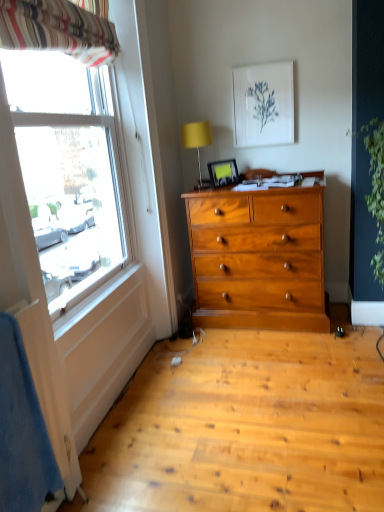
What do you see at coordinates (263, 104) in the screenshot? This screenshot has height=512, width=384. I see `white paper at upper center, positioned as the first picture frame in top-to-bottom order` at bounding box center [263, 104].

Where is `matte plastic picture frame at upper center, which appears as the 1th picture frame when ordered from the bottom`? The width and height of the screenshot is (384, 512). matte plastic picture frame at upper center, which appears as the 1th picture frame when ordered from the bottom is located at coordinates (223, 173).

Identify the location of curtain in front of the yellow fabric lampshade at upper center. (58, 30).

From the picture: Can we say yellow fabric lampshade at upper center lies outside striped fabric curtain at upper left?

Absolutely, yellow fabric lampshade at upper center is external to striped fabric curtain at upper left.

Which object is positioned more to the left, yellow fabric lampshade at upper center or striped fabric curtain at upper left?

Positioned to the left is striped fabric curtain at upper left.

Is yellow fabric lampshade at upper center turned away from striped fabric curtain at upper left?

yellow fabric lampshade at upper center is not turned away from striped fabric curtain at upper left.

Is striped fabric curtain at upper left positioned in front of green leafy plant at right?

Yes, striped fabric curtain at upper left is closer to the camera.

Does point (66, 39) appear closer or farther from the camera than point (381, 140)?

Point (66, 39) is positioned closer to the camera compared to point (381, 140).

How much distance is there between striped fabric curtain at upper left and green leafy plant at right?

striped fabric curtain at upper left is 1.72 meters away from green leafy plant at right.

The width and height of the screenshot is (384, 512). I want to click on curtain above the green leafy plant at right (from the image's perspective), so click(58, 30).

Which object is positioned more to the right, white paper at upper center, placed as the 2th picture frame when sorted from left to right, or matte plastic picture frame at upper center, marked as the first picture frame in a left-to-right arrangement?

Positioned to the right is white paper at upper center, placed as the 2th picture frame when sorted from left to right.

Is white paper at upper center, acting as the second picture frame starting from the bottom, aimed at matte plastic picture frame at upper center, the 2th picture frame when ordered from right to left?

No.

Based on the photo, do you think white paper at upper center, acting as the second picture frame starting from the bottom, is within matte plastic picture frame at upper center, which appears as the 1th picture frame when ordered from the bottom, or outside of it?

white paper at upper center, acting as the second picture frame starting from the bottom, is located beyond the bounds of matte plastic picture frame at upper center, which appears as the 1th picture frame when ordered from the bottom.

In the image, there is a white paper at upper center, positioned as the first picture frame in top-to-bottom order. At what (x,y) coordinates should I click in order to perform the action: click on picture frame below it (from a real-world perspective). Please return your answer as a coordinate pair (x, y). This screenshot has width=384, height=512. Looking at the image, I should click on (223, 173).

From the image's perspective, is striped fabric curtain at upper left above or below white paper at upper center, the 1th picture frame positioned from the right?

From the image's perspective, striped fabric curtain at upper left appears above white paper at upper center, the 1th picture frame positioned from the right.

Considering the relative sizes of striped fabric curtain at upper left and white paper at upper center, placed as the 2th picture frame when sorted from left to right, in the image provided, is striped fabric curtain at upper left shorter than white paper at upper center, placed as the 2th picture frame when sorted from left to right,?

Correct, striped fabric curtain at upper left is not as tall as white paper at upper center, placed as the 2th picture frame when sorted from left to right.

Considering the relative sizes of striped fabric curtain at upper left and white paper at upper center, acting as the second picture frame starting from the bottom, in the image provided, is striped fabric curtain at upper left wider than white paper at upper center, acting as the second picture frame starting from the bottom,?

Yes, striped fabric curtain at upper left is wider than white paper at upper center, acting as the second picture frame starting from the bottom.

How much distance is there between green leafy plant at right and matte plastic picture frame at upper center, marked as the first picture frame in a left-to-right arrangement?

green leafy plant at right and matte plastic picture frame at upper center, marked as the first picture frame in a left-to-right arrangement, are 38.43 inches apart from each other.

Does green leafy plant at right have a larger size compared to matte plastic picture frame at upper center, marked as the first picture frame in a left-to-right arrangement?

Indeed, green leafy plant at right has a larger size compared to matte plastic picture frame at upper center, marked as the first picture frame in a left-to-right arrangement.

Is green leafy plant at right to the left or to the right of matte plastic picture frame at upper center, which ranks as the second picture frame in top-to-bottom order, in the image?

From the image, it's evident that green leafy plant at right is to the right of matte plastic picture frame at upper center, which ranks as the second picture frame in top-to-bottom order.

Can you confirm if green leafy plant at right is shorter than matte plastic picture frame at upper center, which ranks as the second picture frame in top-to-bottom order?

Incorrect, the height of green leafy plant at right does not fall short of that of matte plastic picture frame at upper center, which ranks as the second picture frame in top-to-bottom order.

From the image's perspective, which is below, striped fabric curtain at upper left or yellow fabric lampshade at upper center?

yellow fabric lampshade at upper center appears lower in the image.

Do you think striped fabric curtain at upper left is within yellow fabric lampshade at upper center, or outside of it?

striped fabric curtain at upper left is not enclosed by yellow fabric lampshade at upper center.

Considering the positions of objects striped fabric curtain at upper left and yellow fabric lampshade at upper center in the image provided, who is more to the left, striped fabric curtain at upper left or yellow fabric lampshade at upper center?

Positioned to the left is striped fabric curtain at upper left.

Which object is closer to the camera, striped fabric curtain at upper left or yellow fabric lampshade at upper center?

striped fabric curtain at upper left is more forward.

Looking at this image, can you confirm if white paper at upper center, the 1th picture frame positioned from the right, is positioned to the left of green leafy plant at right?

Yes.

Based on their sizes in the image, would you say white paper at upper center, positioned as the first picture frame in top-to-bottom order, is bigger or smaller than green leafy plant at right?

Clearly, white paper at upper center, positioned as the first picture frame in top-to-bottom order, is smaller in size than green leafy plant at right.

From a real-world perspective, does white paper at upper center, the 1th picture frame positioned from the right, sit lower than green leafy plant at right?

Incorrect, from a real-world perspective, white paper at upper center, the 1th picture frame positioned from the right, is higher than green leafy plant at right.

Identify the location of lamp on the right of the striped fabric curtain at upper left. (196, 138).

In the image, there is a striped fabric curtain at upper left. Identify the location of plant below it (from the image's perspective). Image resolution: width=384 pixels, height=512 pixels. (375, 188).

Considering their positions, is yellow fabric lampshade at upper center positioned closer to white paper at upper center, the 1th picture frame positioned from the right, than matte plastic picture frame at upper center, which ranks as the second picture frame in top-to-bottom order?

Among the two, yellow fabric lampshade at upper center is located nearer to white paper at upper center, the 1th picture frame positioned from the right.

Which object lies further to the anchor point matte plastic picture frame at upper center, the 2th picture frame when ordered from right to left, white paper at upper center, the 1th picture frame positioned from the right, or green leafy plant at right?

Among the two, green leafy plant at right is located further to matte plastic picture frame at upper center, the 2th picture frame when ordered from right to left.

Considering their positions, is striped fabric curtain at upper left positioned closer to green leafy plant at right than white paper at upper center, positioned as the first picture frame in top-to-bottom order?

white paper at upper center, positioned as the first picture frame in top-to-bottom order, is positioned closer to the anchor green leafy plant at right.

Based on their spatial positions, is striped fabric curtain at upper left or matte plastic picture frame at upper center, marked as the first picture frame in a left-to-right arrangement, closer to yellow fabric lampshade at upper center?

matte plastic picture frame at upper center, marked as the first picture frame in a left-to-right arrangement, is positioned closer to the anchor yellow fabric lampshade at upper center.

Estimate the real-world distances between objects in this image. Which object is further from matte plastic picture frame at upper center, the 2th picture frame when ordered from right to left, green leafy plant at right or striped fabric curtain at upper left?

The object further to matte plastic picture frame at upper center, the 2th picture frame when ordered from right to left, is striped fabric curtain at upper left.

Considering their positions, is white paper at upper center, placed as the 2th picture frame when sorted from left to right, positioned further to green leafy plant at right than striped fabric curtain at upper left?

striped fabric curtain at upper left lies further to green leafy plant at right than the other object.

From the image, which object appears to be nearer to white paper at upper center, the 1th picture frame positioned from the right, striped fabric curtain at upper left or matte plastic picture frame at upper center, which appears as the 1th picture frame when ordered from the bottom?

matte plastic picture frame at upper center, which appears as the 1th picture frame when ordered from the bottom, lies closer to white paper at upper center, the 1th picture frame positioned from the right, than the other object.

Looking at the image, which one is located closer to green leafy plant at right, white paper at upper center, acting as the second picture frame starting from the bottom, or yellow fabric lampshade at upper center?

Among the two, white paper at upper center, acting as the second picture frame starting from the bottom, is located nearer to green leafy plant at right.

This screenshot has height=512, width=384. I want to click on lamp between striped fabric curtain at upper left and matte plastic picture frame at upper center, the 2th picture frame when ordered from right to left, from front to back, so click(196, 138).

What are the coordinates of `lamp positioned between striped fabric curtain at upper left and white paper at upper center, placed as the 2th picture frame when sorted from left to right, from near to far` in the screenshot? It's located at (196, 138).

I want to click on lamp between striped fabric curtain at upper left and green leafy plant at right from left to right, so click(x=196, y=138).

At what (x,y) coordinates should I click in order to perform the action: click on lamp between white paper at upper center, placed as the 2th picture frame when sorted from left to right, and matte plastic picture frame at upper center, which appears as the 1th picture frame when ordered from the bottom, vertically. Please return your answer as a coordinate pair (x, y). The width and height of the screenshot is (384, 512). Looking at the image, I should click on (196, 138).